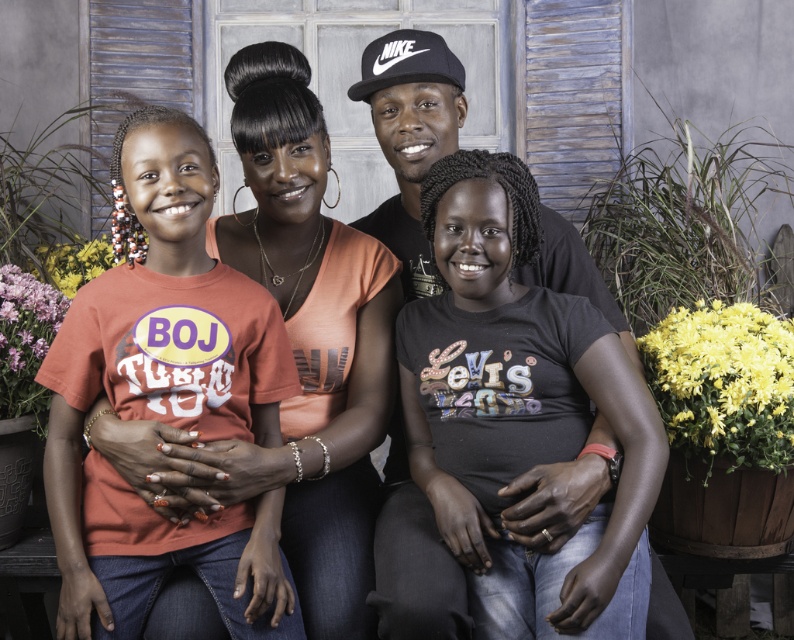
From the picture: How distant is matte black t-shirt at center from matte orange t-shirt at left?

They are 18.54 inches apart.

Describe the element at coordinates (511, 419) in the screenshot. I see `matte black t-shirt at center` at that location.

The height and width of the screenshot is (640, 794). I want to click on matte black t-shirt at center, so coord(511,419).